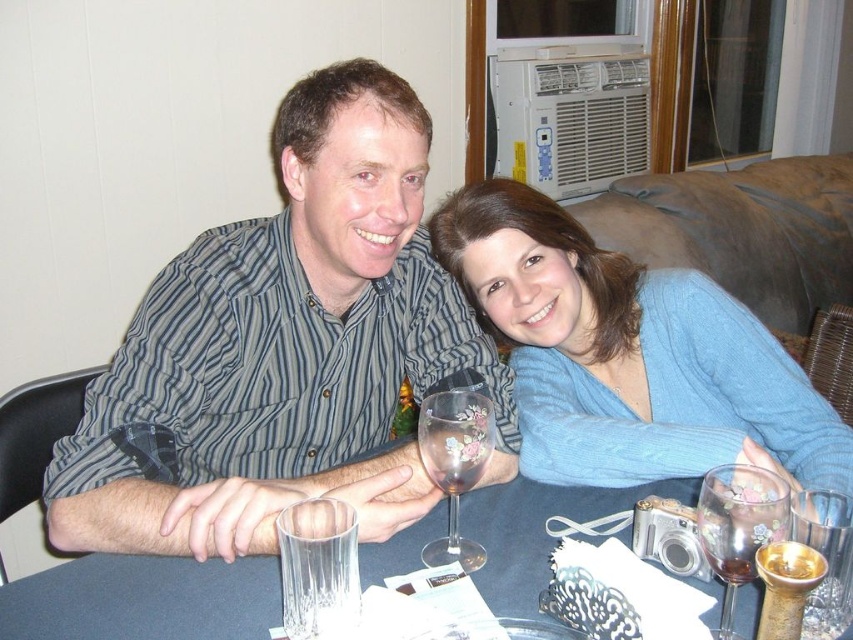
Question: Is clear glass table at center to the right of translucent glass wine glass at lower right from the viewer's perspective?

Choices:
 (A) yes
 (B) no

Answer: (B)

Question: Which object is the farthest from the blue knitted sweater at upper right?

Choices:
 (A) striped shirt at center
 (B) translucent glass wine at center

Answer: (B)

Question: Which object appears farthest from the camera in this image?

Choices:
 (A) transparent glass wine glass at lower right
 (B) translucent glass wine glass at lower right
 (C) clear glass table at center
 (D) translucent glass wine at center

Answer: (C)

Question: From the image, what is the correct spatial relationship of translucent floral-patterned wine glass at center in relation to translucent glass wine at center?

Choices:
 (A) right
 (B) left

Answer: (B)

Question: Which point appears farthest from the camera in this image?

Choices:
 (A) (753, 573)
 (B) (769, 410)
 (C) (827, 545)
 (D) (216, 637)

Answer: (B)

Question: Observing the image, what is the correct spatial positioning of translucent floral-patterned wine glass at center in reference to translucent glass wine at center?

Choices:
 (A) above
 (B) below

Answer: (A)